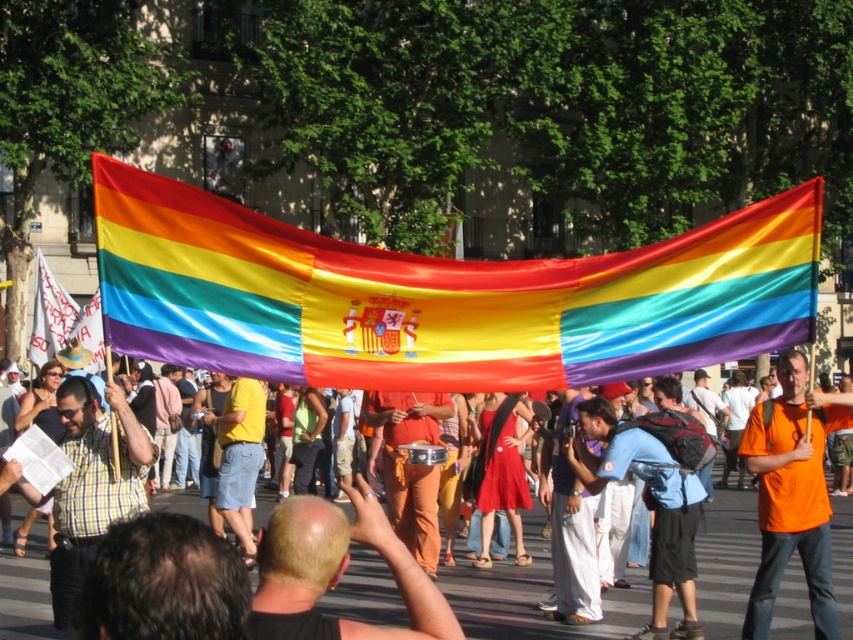
Question: Does orange cotton shirt at center appear over rainbow fabric flag at upper center?

Choices:
 (A) no
 (B) yes

Answer: (A)

Question: Can you confirm if orange cotton shirt at center is positioned to the left of orange t-shirt at center?

Choices:
 (A) no
 (B) yes

Answer: (B)

Question: Which of the following is the closest to the observer?

Choices:
 (A) checkered fabric shirt at center
 (B) rainbow fabric flag at upper center

Answer: (A)

Question: Among these points, which one is nearest to the camera?

Choices:
 (A) click(x=821, y=483)
 (B) click(x=793, y=234)
 (C) click(x=79, y=515)
 (D) click(x=496, y=637)

Answer: (B)

Question: In this image, where is silky rainbow flag at center located relative to checkered fabric shirt at center?

Choices:
 (A) right
 (B) left

Answer: (A)

Question: Estimate the real-world distances between objects in this image. Which object is farther from the orange t-shirt at center?

Choices:
 (A) orange cotton shirt at center
 (B) rainbow fabric flag at upper center
 (C) silky rainbow flag at center
 (D) checkered fabric shirt at center

Answer: (B)